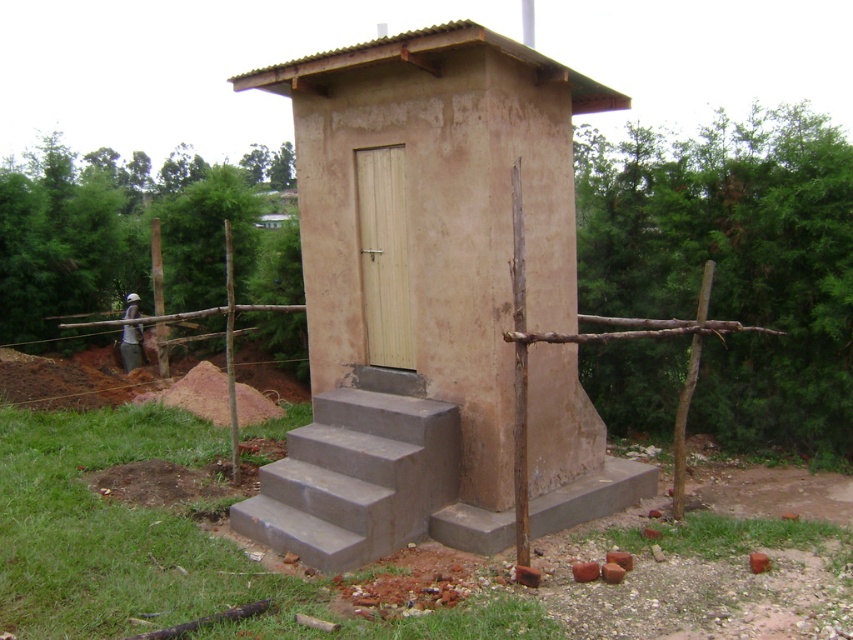
Question: Which point is closer to the camera taking this photo?

Choices:
 (A) (431, 429)
 (B) (599, 509)
 (C) (383, 116)

Answer: (A)

Question: Estimate the real-world distances between objects in this image. Which object is closer to the matte concrete hut at center?

Choices:
 (A) gray concrete stairs at center
 (B) gray concrete steps at lower center

Answer: (A)

Question: Is matte concrete hut at center smaller than gray concrete steps at lower center?

Choices:
 (A) no
 (B) yes

Answer: (A)

Question: Does matte concrete hut at center come behind gray concrete steps at lower center?

Choices:
 (A) no
 (B) yes

Answer: (A)

Question: Does gray concrete stairs at center have a smaller size compared to gray concrete steps at lower center?

Choices:
 (A) yes
 (B) no

Answer: (B)

Question: Which of the following is the farthest from the observer?

Choices:
 (A) gray concrete stairs at center
 (B) gray concrete steps at lower center

Answer: (B)